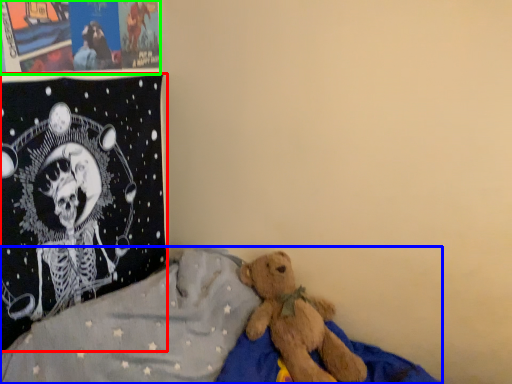
Question: Which object is the farthest from pillow (highlighted by a red box)? Choose among these: bed (highlighted by a blue box) or poster page (highlighted by a green box).

Choices:
 (A) bed
 (B) poster page

Answer: (A)